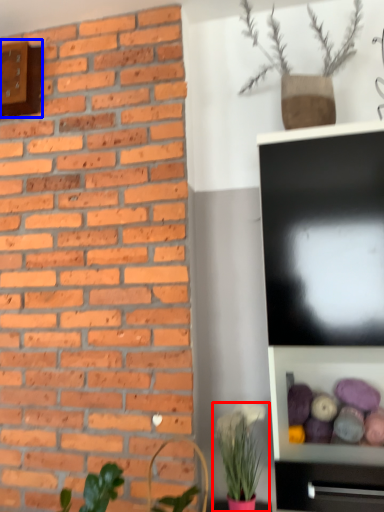
Question: Which of the following is the closest to the observer, houseplant (highlighted by a red box) or clock (highlighted by a blue box)?

Choices:
 (A) houseplant
 (B) clock

Answer: (A)